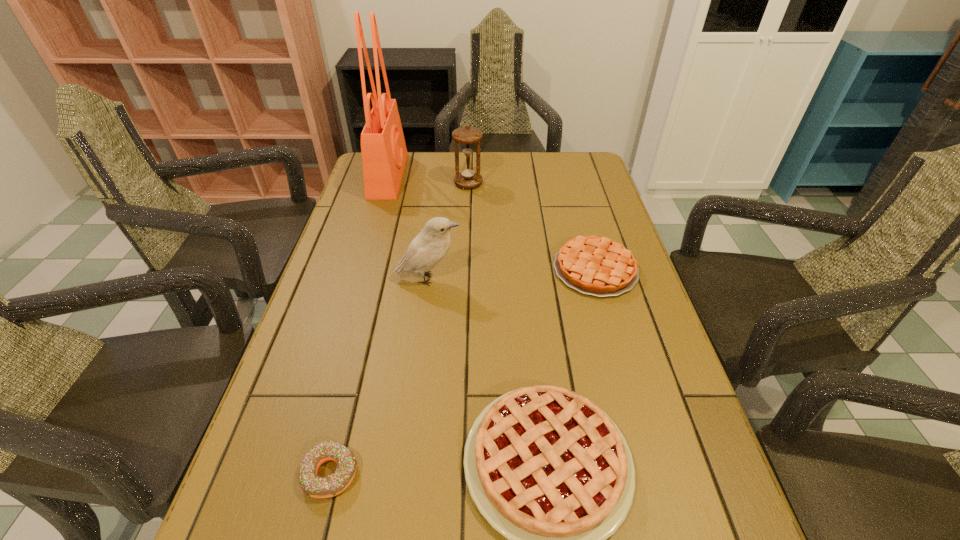
You are a GUI agent. You are given a task and a screenshot of the screen. Output one action in this format:
    pyautogui.click(x=<x>, y=<y>)
    Task: Click on the free space between the hourglass and the doughnut
    This screenshot has width=960, height=540.
    Given the screenshot: What is the action you would take?
    tap(399, 328)

The image size is (960, 540). Identify the location of vacant region between the farther pie and the hourglass. (532, 226).

At what (x,y) coordinates should I click in order to perform the action: click on vacant space that is in between the farther pie and the doughnut. Please return your answer as a coordinate pair (x, y). The height and width of the screenshot is (540, 960). Looking at the image, I should click on (463, 372).

Locate an element on the screen. Image resolution: width=960 pixels, height=540 pixels. free spot between the shorter pie and the doughnut is located at coordinates (463, 372).

You are a GUI agent. You are given a task and a screenshot of the screen. Output one action in this format:
    pyautogui.click(x=<x>, y=<y>)
    Task: Click on the unoccupied area between the shorter pie and the hourglass
    
    Given the screenshot: What is the action you would take?
    pyautogui.click(x=532, y=226)

Where is `free point between the hourglass and the tote bag`? The image size is (960, 540). free point between the hourglass and the tote bag is located at coordinates (428, 179).

The image size is (960, 540). In order to click on free space between the tallest object and the bird in this screenshot , I will do click(x=408, y=227).

Where is `free spot between the doughnut and the farther pie`? free spot between the doughnut and the farther pie is located at coordinates (463, 372).

The height and width of the screenshot is (540, 960). What are the coordinates of `the fifth closest object to the shorter pie` in the screenshot? It's located at (313, 485).

Identify which object is located as the fifth nearest to the doughnut. Please provide its 2D coordinates. Your answer should be formatted as a tuple, i.e. [(x, y)], where the tuple contains the x and y coordinates of a point satisfying the conditions above.

[(469, 177)]